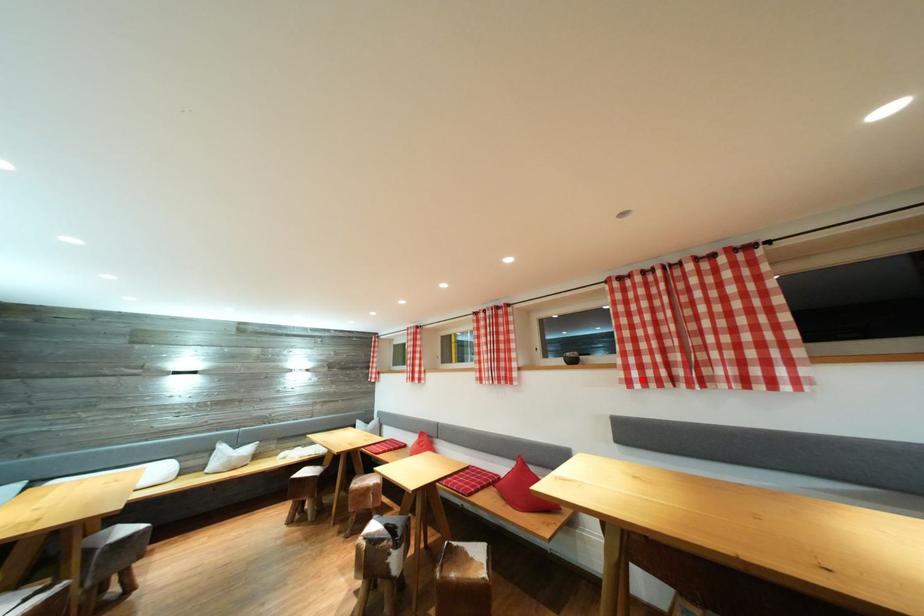
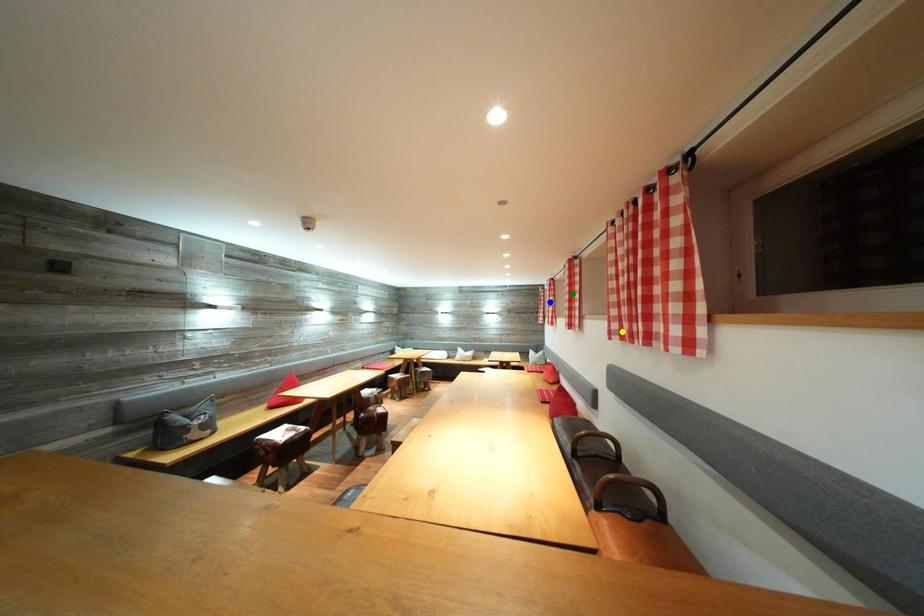
Question: I am providing you with two images of the same scene from different viewpoints. A red point is marked on the first image. You are given multiple points on the second image. Which spot in image 2 lines up with the point in image 1?

Choices:
 (A) green point
 (B) yellow point
 (C) blue point

Answer: (B)